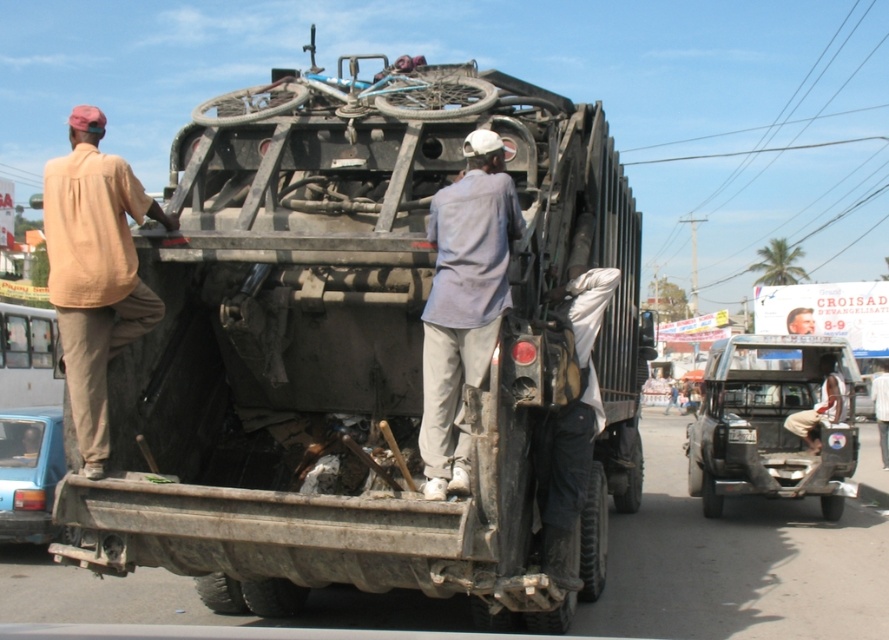
Does rusty metal garbage truck at center have a greater width compared to light blue fabric shirt at center?

Correct, the width of rusty metal garbage truck at center exceeds that of light blue fabric shirt at center.

Locate an element on the screen. rusty metal garbage truck at center is located at coordinates (359, 349).

I want to click on rusty metal garbage truck at center, so click(359, 349).

Does beige fabric shirt at upper left have a larger size compared to matte blue car at left?

Indeed, beige fabric shirt at upper left has a larger size compared to matte blue car at left.

Does point (87, 260) come farther from viewer compared to point (43, 456)?

No.

Which is in front, point (95, 224) or point (51, 448)?

Positioned in front is point (95, 224).

At what (x,y) coordinates should I click in order to perform the action: click on beige fabric shirt at upper left. Please return your answer as a coordinate pair (x, y). Image resolution: width=889 pixels, height=640 pixels. Looking at the image, I should click on (95, 272).

Does rusty metal garbage truck at center appear on the left side of metallic silver truck at center?

Indeed, rusty metal garbage truck at center is positioned on the left side of metallic silver truck at center.

Does point (51, 273) lie behind point (749, 476)?

No, it is not.

What do you see at coordinates (359, 349) in the screenshot?
I see `rusty metal garbage truck at center` at bounding box center [359, 349].

Identify the location of rusty metal garbage truck at center. (359, 349).